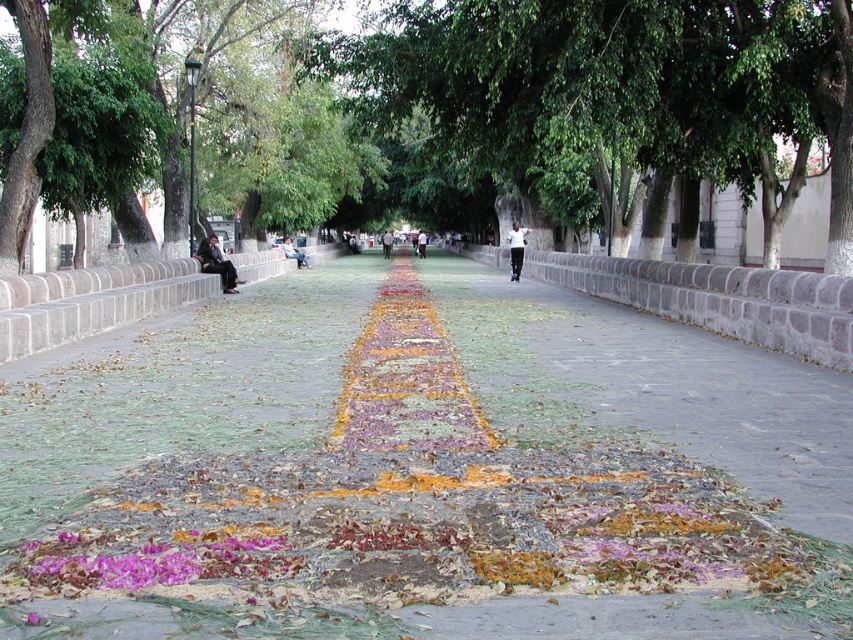
You are standing at the starting point of the pathway and want to reach the green leafy tree at center. Which direction should you walk to reach it?

You should walk towards the center of the pathway to reach the green leafy tree at center, as it is located at point (451, 109).

You are standing at the starting point of the pathway and want to reach a destination located at point (691, 314). There is an obstacle at point (635, 401). Will you encounter the obstacle before reaching your destination?

Yes, you will encounter the obstacle at point (635, 401) before reaching your destination at point (691, 314) because point (635, 401) is closer to the camera than point (691, 314).

You are a gardener who needs to place a new decorative statue exactly between the green leafy tree at center and the gray concrete bench at center. Which object will the statue be closer to?

The statue will be closer to the gray concrete bench at center because the green leafy tree at center is positioned on the right side of the gray concrete bench at center, meaning the bench is to the left of the tree. Therefore, placing the statue exactly between them would place it closer to the bench since it is positioned to the left of the tree.